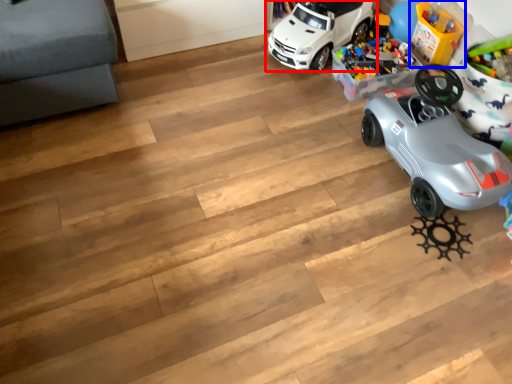
Question: Which of the following is the farthest to the observer, car (highlighted by a red box) or toy (highlighted by a blue box)?

Choices:
 (A) car
 (B) toy

Answer: (B)